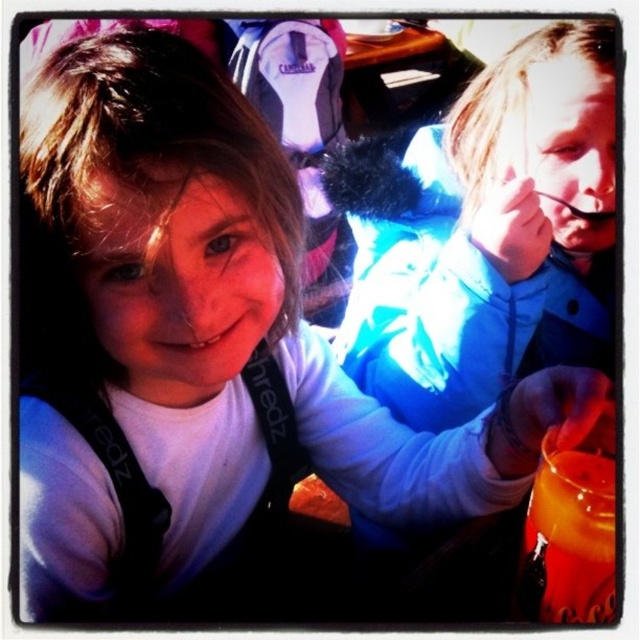
Question: Which of the following is the farthest from the observer?

Choices:
 (A) (577, 280)
 (B) (608, 570)

Answer: (A)

Question: Is blue softshell jacket at upper right further to camera compared to orange liquid at lower right?

Choices:
 (A) no
 (B) yes

Answer: (B)

Question: Which point is closer to the camera taking this photo?

Choices:
 (A) (529, 572)
 (B) (484, 292)

Answer: (A)

Question: Is blue softshell jacket at upper right below orange liquid at lower right?

Choices:
 (A) no
 (B) yes

Answer: (A)

Question: Is blue softshell jacket at upper right positioned before orange liquid at lower right?

Choices:
 (A) no
 (B) yes

Answer: (A)